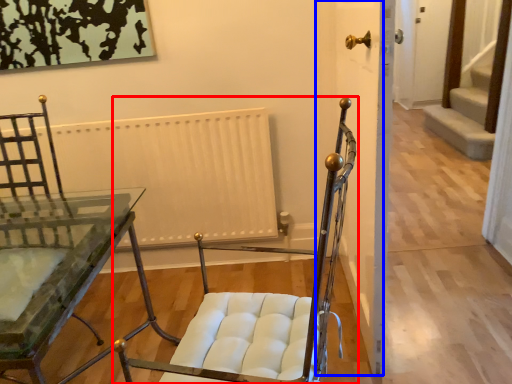
Question: Which point is further to the camera, chair (highlighted by a red box) or door (highlighted by a blue box)?

Choices:
 (A) chair
 (B) door

Answer: (B)